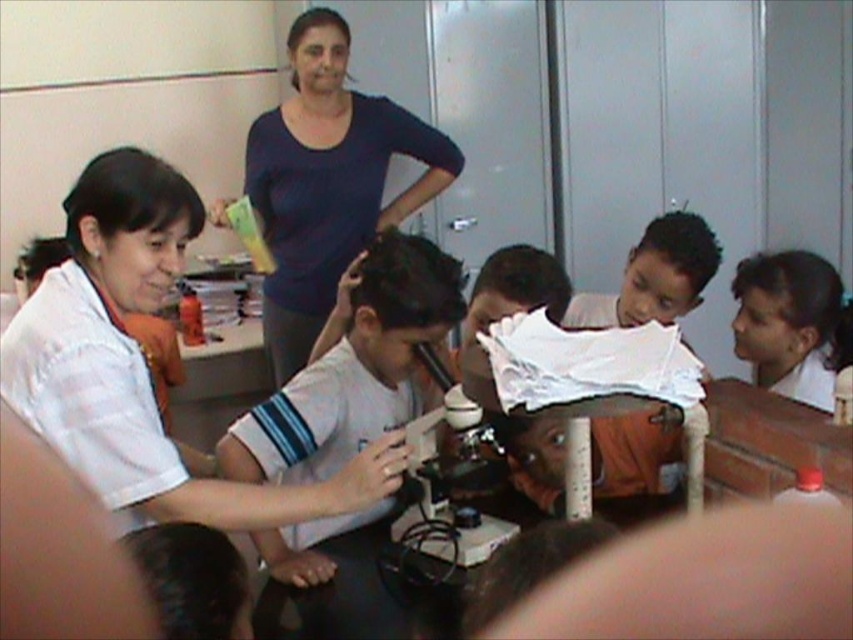
Does black hair at upper right appear under metallic microscope at center?

Incorrect, black hair at upper right is not positioned below metallic microscope at center.

Does black hair at upper right have a greater width compared to metallic microscope at center?

Indeed, black hair at upper right has a greater width compared to metallic microscope at center.

Does point (779, 378) come farther from viewer compared to point (477, 420)?

Yes, point (779, 378) is behind point (477, 420).

Find the location of a particular element. Image resolution: width=853 pixels, height=640 pixels. black hair at upper right is located at coordinates (788, 323).

Can you confirm if white matte shirt at left is positioned to the right of white matte shirt at center?

Incorrect, white matte shirt at left is not on the right side of white matte shirt at center.

Where is `white matte shirt at left`? The height and width of the screenshot is (640, 853). white matte shirt at left is located at coordinates coord(141,364).

Is point (102, 385) less distant than point (424, 321)?

Yes, point (102, 385) is in front of point (424, 321).

This screenshot has width=853, height=640. I want to click on white matte shirt at left, so click(x=141, y=364).

Between white matte shirt at left and dark blue shirt at upper center, which one is positioned lower?

white matte shirt at left is below.

Can you confirm if white matte shirt at left is shorter than dark blue shirt at upper center?

Correct, white matte shirt at left is not as tall as dark blue shirt at upper center.

Between point (96, 225) and point (300, 44), which one is positioned behind?

The point (300, 44) is behind.

What are the coordinates of `white matte shirt at left` in the screenshot? It's located at (141, 364).